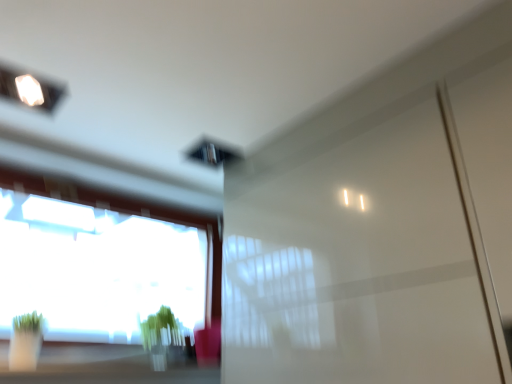
Question: Could you tell me if glossy white screen door at center is facing green matte plant at lower center?

Choices:
 (A) yes
 (B) no

Answer: (B)

Question: Would you say glossy white screen door at center is a long distance from green matte plant at lower center?

Choices:
 (A) no
 (B) yes

Answer: (A)

Question: From a real-world perspective, is glossy white screen door at center located beneath green matte plant at lower center?

Choices:
 (A) no
 (B) yes

Answer: (A)

Question: Can you confirm if glossy white screen door at center is taller than green matte plant at lower center?

Choices:
 (A) no
 (B) yes

Answer: (B)

Question: Is glossy white screen door at center outside of green matte plant at lower center?

Choices:
 (A) no
 (B) yes

Answer: (B)

Question: From the image's perspective, is green matte plant at lower center above or below transparent glass window at lower left?

Choices:
 (A) above
 (B) below

Answer: (B)

Question: Based on their positions, is green matte plant at lower center located to the left or right of transparent glass window at lower left?

Choices:
 (A) left
 (B) right

Answer: (B)

Question: In terms of height, does green matte plant at lower center look taller or shorter compared to transparent glass window at lower left?

Choices:
 (A) short
 (B) tall

Answer: (A)

Question: From a real-world perspective, is green matte plant at lower center above or below transparent glass window at lower left?

Choices:
 (A) below
 (B) above

Answer: (A)

Question: Is transparent glass window at lower left spatially inside green matte plant at lower center, or outside of it?

Choices:
 (A) inside
 (B) outside

Answer: (B)

Question: Is transparent glass window at lower left wider or thinner than green matte plant at lower center?

Choices:
 (A) thin
 (B) wide

Answer: (A)

Question: Based on their sizes in the image, would you say transparent glass window at lower left is bigger or smaller than green matte plant at lower center?

Choices:
 (A) big
 (B) small

Answer: (A)

Question: From the image's perspective, is transparent glass window at lower left positioned above or below green matte plant at lower center?

Choices:
 (A) above
 (B) below

Answer: (A)

Question: From a real-world perspective, is transparent glass window at lower left physically located above or below glossy white screen door at center?

Choices:
 (A) above
 (B) below

Answer: (A)

Question: Considering their positions, is transparent glass window at lower left located in front of or behind glossy white screen door at center?

Choices:
 (A) front
 (B) behind

Answer: (B)